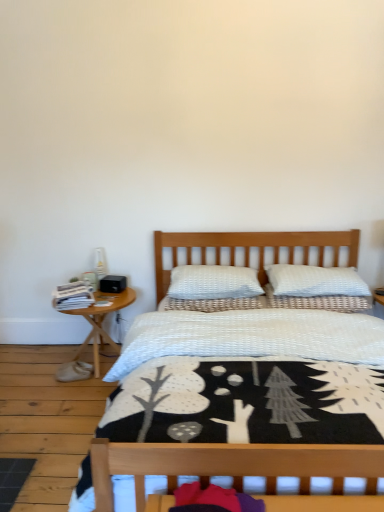
Question: Should I look upward or downward to see white textured pillow at center, the 2th pillow from the right?

Choices:
 (A) down
 (B) up

Answer: (A)

Question: From a real-world perspective, is white textured pillow at center, which is the second pillow in left-to-right order, under white textured bed at center?

Choices:
 (A) yes
 (B) no

Answer: (B)

Question: From a real-world perspective, does white textured pillow at center, which is the second pillow in left-to-right order, stand above white textured bed at center?

Choices:
 (A) yes
 (B) no

Answer: (A)

Question: Are white textured pillow at center, which is the second pillow in left-to-right order, and white textured bed at center located far from each other?

Choices:
 (A) no
 (B) yes

Answer: (A)

Question: Considering the relative sizes of white textured pillow at center, which is the second pillow in left-to-right order, and white textured bed at center in the image provided, is white textured pillow at center, which is the second pillow in left-to-right order, thinner than white textured bed at center?

Choices:
 (A) no
 (B) yes

Answer: (B)

Question: Considering the relative sizes of white textured pillow at center, the 2th pillow from the right, and white textured bed at center in the image provided, is white textured pillow at center, the 2th pillow from the right, taller than white textured bed at center?

Choices:
 (A) yes
 (B) no

Answer: (B)

Question: Would you say white textured bed at center is part of white textured pillow at center, which is the second pillow in left-to-right order,'s contents?

Choices:
 (A) yes
 (B) no

Answer: (B)

Question: Does white textured pillow at center, which is the second pillow in left-to-right order, have a lesser width compared to woodennightstand at left?

Choices:
 (A) no
 (B) yes

Answer: (B)

Question: Can you confirm if white textured pillow at center, which is the second pillow in left-to-right order, is wider than woodennightstand at left?

Choices:
 (A) yes
 (B) no

Answer: (B)

Question: Can you confirm if white textured pillow at center, which is the second pillow in left-to-right order, is taller than woodennightstand at left?

Choices:
 (A) yes
 (B) no

Answer: (B)

Question: Could you tell me if white textured pillow at center, which is the second pillow in left-to-right order, is facing woodennightstand at left?

Choices:
 (A) yes
 (B) no

Answer: (B)

Question: Does white textured pillow at center, which is the second pillow in left-to-right order, come behind woodennightstand at left?

Choices:
 (A) no
 (B) yes

Answer: (B)

Question: Considering the relative sizes of white textured pillow at center, the 2th pillow from the right, and woodennightstand at left in the image provided, is white textured pillow at center, the 2th pillow from the right, smaller than woodennightstand at left?

Choices:
 (A) yes
 (B) no

Answer: (A)

Question: Can you confirm if white textured bed at center is shorter than white textured pillow at upper center, which is counted as the 1th pillow, starting from the right?

Choices:
 (A) yes
 (B) no

Answer: (B)